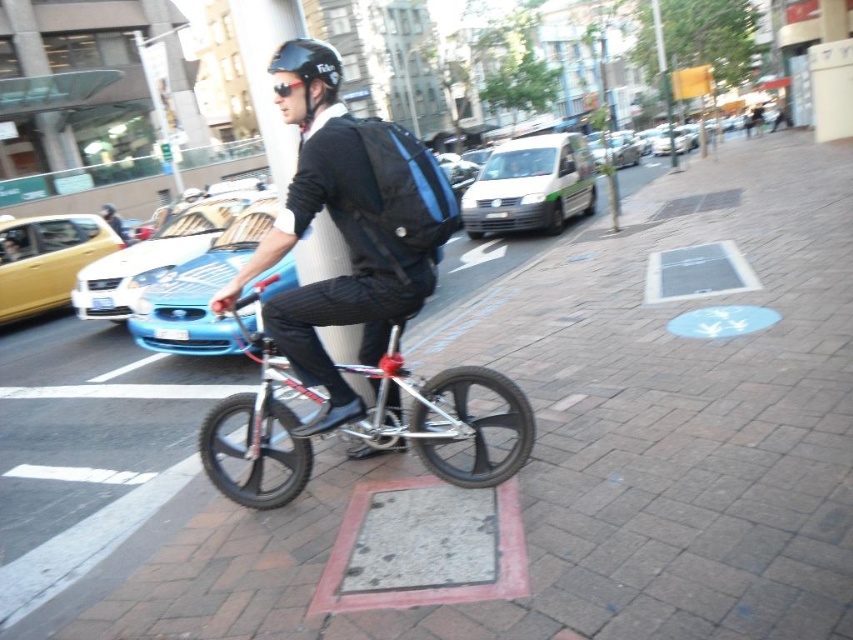
Question: Does silver metallic bicycle at center come behind metallic blue monocycle at center?

Choices:
 (A) yes
 (B) no

Answer: (B)

Question: Does metallic blue monocycle at center have a greater width compared to black matte helmet at upper center?

Choices:
 (A) yes
 (B) no

Answer: (A)

Question: Which point appears farthest from the camera in this image?

Choices:
 (A) [x=212, y=310]
 (B) [x=421, y=432]
 (C) [x=303, y=74]

Answer: (B)

Question: Which is nearer to the black matte helmet at upper center?

Choices:
 (A) metallic blue monocycle at center
 (B) silver metallic bicycle at center
 (C) matte black backpack at center

Answer: (C)

Question: Is matte black backpack at center positioned behind silver metallic bicycle at center?

Choices:
 (A) no
 (B) yes

Answer: (A)

Question: Which point is farther to the camera?

Choices:
 (A) metallic blue monocycle at center
 (B) silver metallic bicycle at center
 (C) matte black backpack at center
 (D) black matte helmet at upper center

Answer: (A)